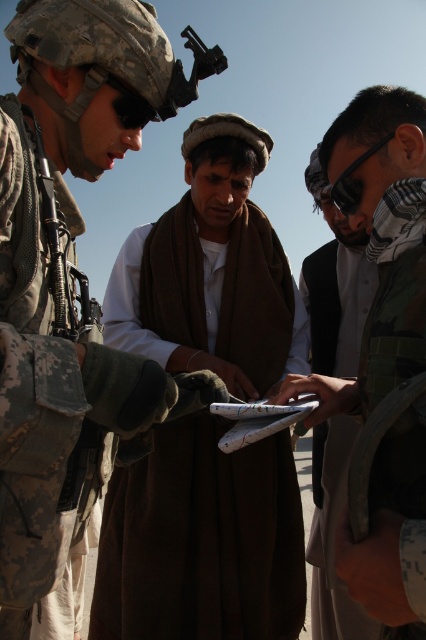
Question: Is white cotton shirt at center to the right of camouflage fabric jacket at center from the viewer's perspective?

Choices:
 (A) yes
 (B) no

Answer: (B)

Question: Observing the image, what is the correct spatial positioning of brown woolen shawl at center in reference to white paper clipboard at center?

Choices:
 (A) left
 (B) right

Answer: (A)

Question: Which point appears farthest from the camera in this image?

Choices:
 (A) (46, 449)
 (B) (357, 572)

Answer: (B)

Question: Among these points, which one is farthest from the camera?

Choices:
 (A) (391, 259)
 (B) (166, 458)
 (C) (19, 109)
 (D) (46, 410)

Answer: (B)

Question: Does camouflage fabric jacket at center have a greater width compared to white fabric shirt at center?

Choices:
 (A) yes
 (B) no

Answer: (B)

Question: Which is nearer to the camouflage fabric jacket at center?

Choices:
 (A) white cotton shirt at center
 (B) white fabric shirt at center
 (C) white paper clipboard at center

Answer: (C)